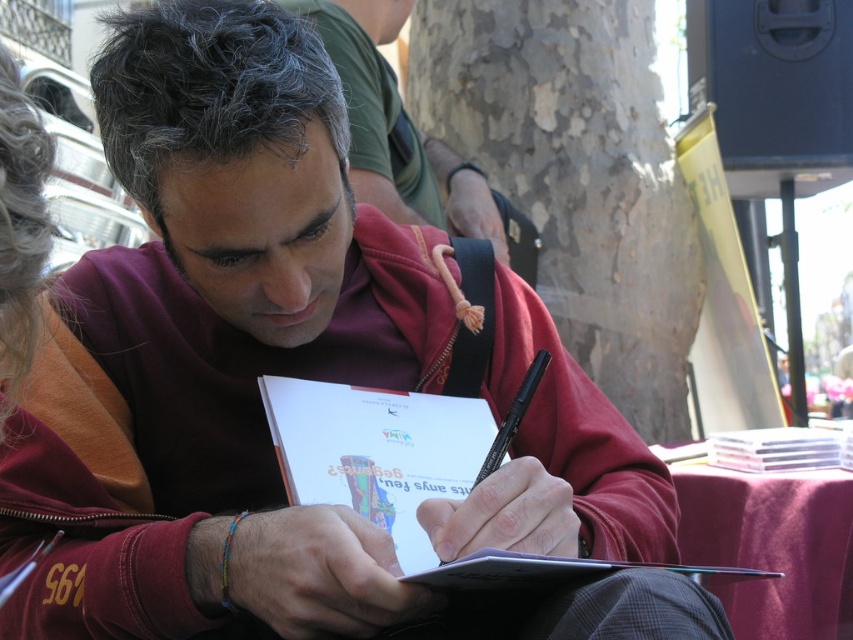
Who is taller, white paper notebook at center or matte red jacket at center?

Standing taller between the two is matte red jacket at center.

The width and height of the screenshot is (853, 640). I want to click on white paper notebook at center, so click(410, 476).

Where is `white paper notebook at center`? This screenshot has width=853, height=640. white paper notebook at center is located at coordinates (410, 476).

Which is more to the right, smooth bark tree at center or transparent plastic case at lower right?

transparent plastic case at lower right is more to the right.

Is smooth bark tree at center wider than transparent plastic case at lower right?

Yes.

Who is more distant from viewer, (544, 208) or (813, 438)?

The point (544, 208) is more distant.

Where is `smooth bark tree at center`? The width and height of the screenshot is (853, 640). smooth bark tree at center is located at coordinates (577, 177).

Between point (502, 465) and point (813, 451), which one is positioned behind?

Point (813, 451)

Find the location of a particular element. white paper notebook at center is located at coordinates (410, 476).